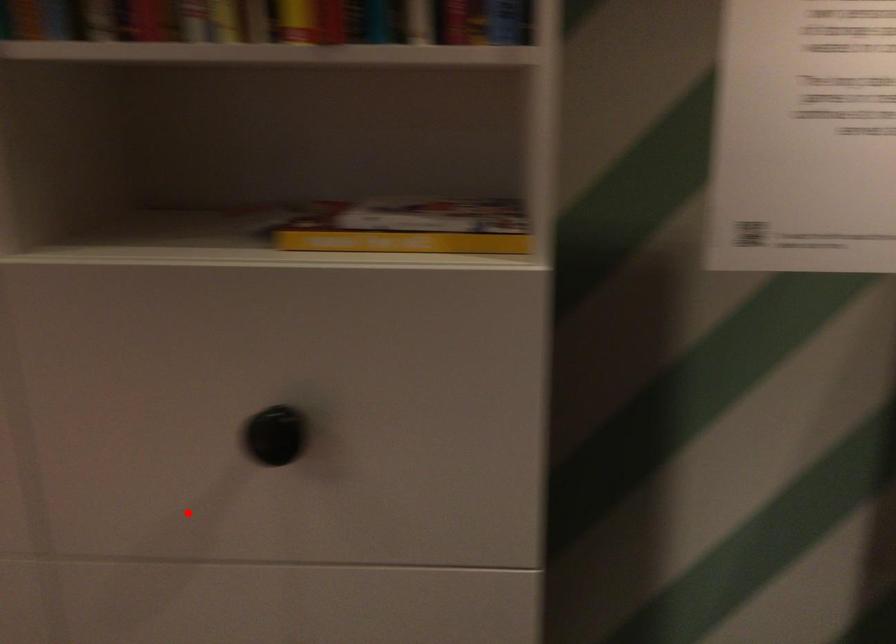
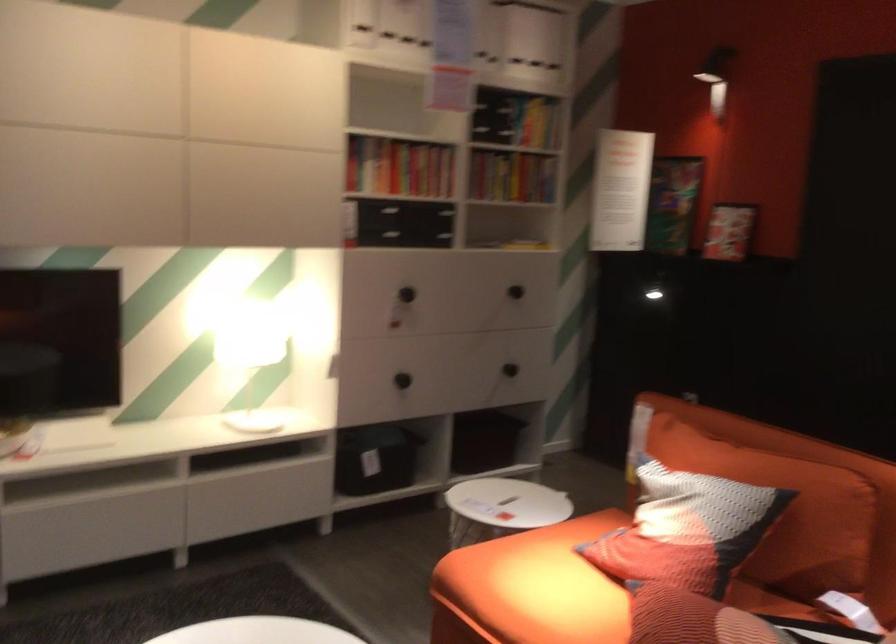
Locate, in the second image, the point that corresponds to the highlighted location in the first image.

(514, 292)